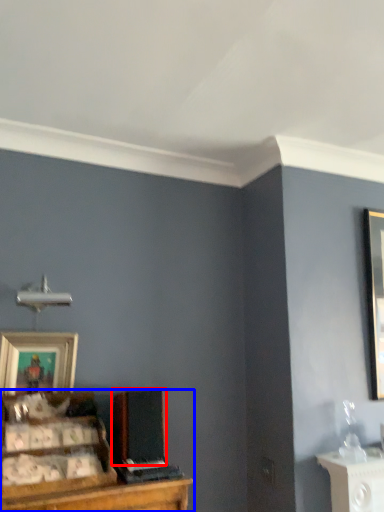
Question: Which object appears closest to the camera in this image, speaker (highlighted by a red box) or entertainment center (highlighted by a blue box)?

Choices:
 (A) speaker
 (B) entertainment center

Answer: (B)